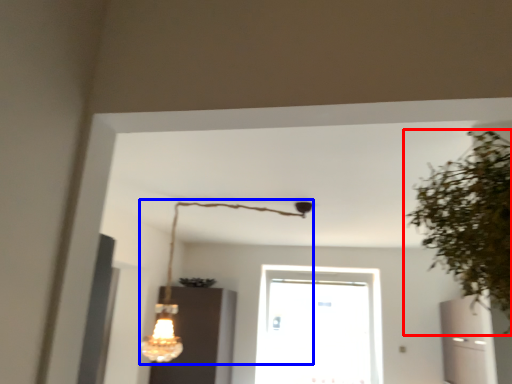
Question: Which object is closer to the camera taking this photo, houseplant (highlighted by a red box) or lamp (highlighted by a blue box)?

Choices:
 (A) houseplant
 (B) lamp

Answer: (A)